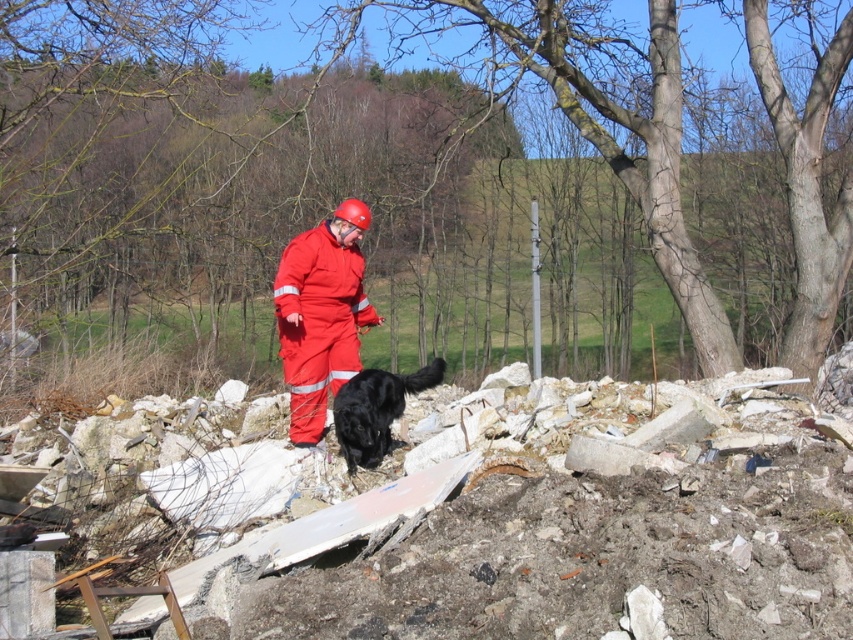
Question: Does matte red jumpsuit at center have a lesser width compared to black fur dog at center?

Choices:
 (A) no
 (B) yes

Answer: (B)

Question: Can you confirm if matte red jumpsuit at center is bigger than black fur dog at center?

Choices:
 (A) no
 (B) yes

Answer: (B)

Question: Does matte red jumpsuit at center appear under black fur dog at center?

Choices:
 (A) yes
 (B) no

Answer: (B)

Question: Which of the following is the farthest from the observer?

Choices:
 (A) matte red jumpsuit at center
 (B) black fur dog at center

Answer: (A)

Question: Which of the following is the closest to the observer?

Choices:
 (A) (346, 428)
 (B) (344, 330)

Answer: (A)